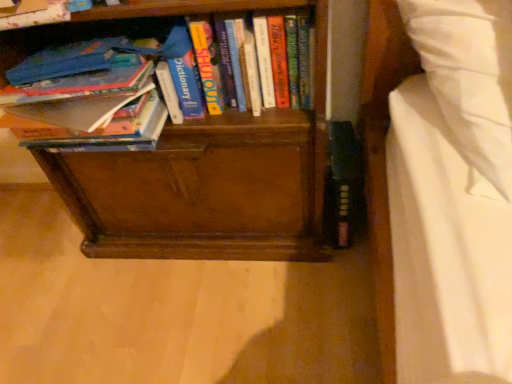
Question: Can you confirm if hardcover book at upper left, the 1th book from the left, is positioned to the right of hardcover book at left, which appears as the 2th book when viewed from the right?

Choices:
 (A) no
 (B) yes

Answer: (A)

Question: Is hardcover book at left, which ranks as the 2th book in left-to-right order, at the back of hardcover book at upper left, the 1th book from the left?

Choices:
 (A) yes
 (B) no

Answer: (B)

Question: From a real-world perspective, is hardcover book at upper left, which ranks as the 3th book in right-to-left order, over hardcover book at left, which ranks as the 2th book in left-to-right order?

Choices:
 (A) no
 (B) yes

Answer: (B)

Question: Considering the relative sizes of hardcover book at upper left, which ranks as the 3th book in right-to-left order, and hardcover book at left, which ranks as the 2th book in left-to-right order, in the image provided, is hardcover book at upper left, which ranks as the 3th book in right-to-left order, smaller than hardcover book at left, which ranks as the 2th book in left-to-right order,?

Choices:
 (A) yes
 (B) no

Answer: (A)

Question: Is hardcover book at upper left, the 1th book from the left, taller than hardcover book at left, which appears as the 2th book when viewed from the right?

Choices:
 (A) no
 (B) yes

Answer: (A)

Question: From the image's perspective, is hardcover book at upper left, which ranks as the 3th book in right-to-left order, under hardcover book at left, which ranks as the 2th book in left-to-right order?

Choices:
 (A) no
 (B) yes

Answer: (A)

Question: Considering the relative sizes of hardcover book at center, arranged as the 1th book when viewed from the right, and hardcover book at upper left, which ranks as the 3th book in right-to-left order, in the image provided, is hardcover book at center, arranged as the 1th book when viewed from the right, taller than hardcover book at upper left, which ranks as the 3th book in right-to-left order,?

Choices:
 (A) yes
 (B) no

Answer: (A)

Question: Does hardcover book at center, placed as the third book when sorted from left to right, turn towards hardcover book at upper left, the 1th book from the left?

Choices:
 (A) no
 (B) yes

Answer: (A)

Question: Is hardcover book at center, placed as the third book when sorted from left to right, outside of hardcover book at upper left, the 1th book from the left?

Choices:
 (A) yes
 (B) no

Answer: (A)

Question: From the image's perspective, does hardcover book at center, placed as the third book when sorted from left to right, appear higher than hardcover book at upper left, the 1th book from the left?

Choices:
 (A) no
 (B) yes

Answer: (A)

Question: Is hardcover book at center, arranged as the 1th book when viewed from the right, smaller than hardcover book at upper left, which ranks as the 3th book in right-to-left order?

Choices:
 (A) yes
 (B) no

Answer: (B)

Question: Considering the relative sizes of hardcover book at center, arranged as the 1th book when viewed from the right, and hardcover book at upper left, which ranks as the 3th book in right-to-left order, in the image provided, is hardcover book at center, arranged as the 1th book when viewed from the right, wider than hardcover book at upper left, which ranks as the 3th book in right-to-left order,?

Choices:
 (A) no
 (B) yes

Answer: (A)

Question: Is hardcover book at left, which appears as the 2th book when viewed from the right, facing towards hardcover book at upper left, the 1th book from the left?

Choices:
 (A) yes
 (B) no

Answer: (B)